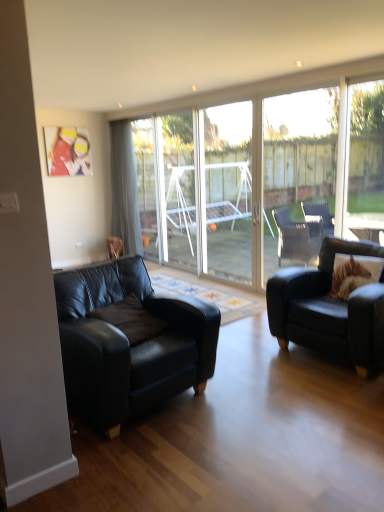
Image resolution: width=384 pixels, height=512 pixels. I want to click on vacant area that is in front of matte black armchair at right, which ranks as the 2th studio couch in left-to-right order, so tap(328, 406).